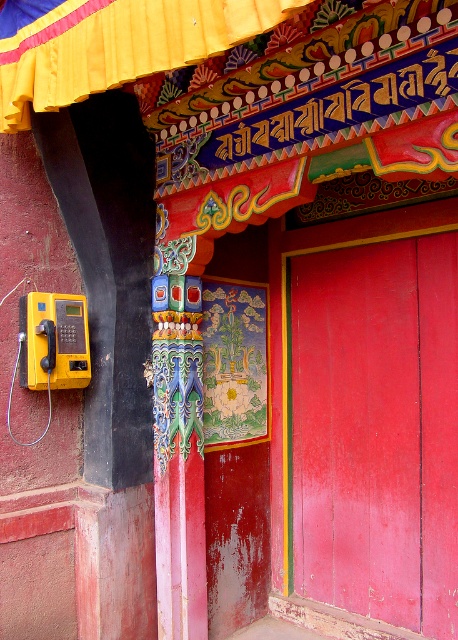
You are standing at the entrance of the building and want to make a phone call. Which object, the painted wood pillar at center or the yellow plastic phone at left, should you approach first?

You should approach the yellow plastic phone at left first because the painted wood pillar at center is further away from you than the yellow plastic phone at left.

Looking at this image, you are standing at the entrance of the building and want to enter through the door. Which object must you pass by first, the smooth glossy wood door at center or the painted wood pillar at center?

You must pass by the smooth glossy wood door at center first because it is in front of the painted wood pillar at center.